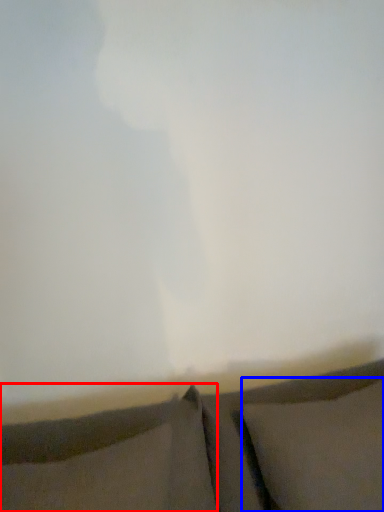
Question: Which point is closer to the camera, pillow (highlighted by a red box) or pillow (highlighted by a blue box)?

Choices:
 (A) pillow
 (B) pillow

Answer: (A)